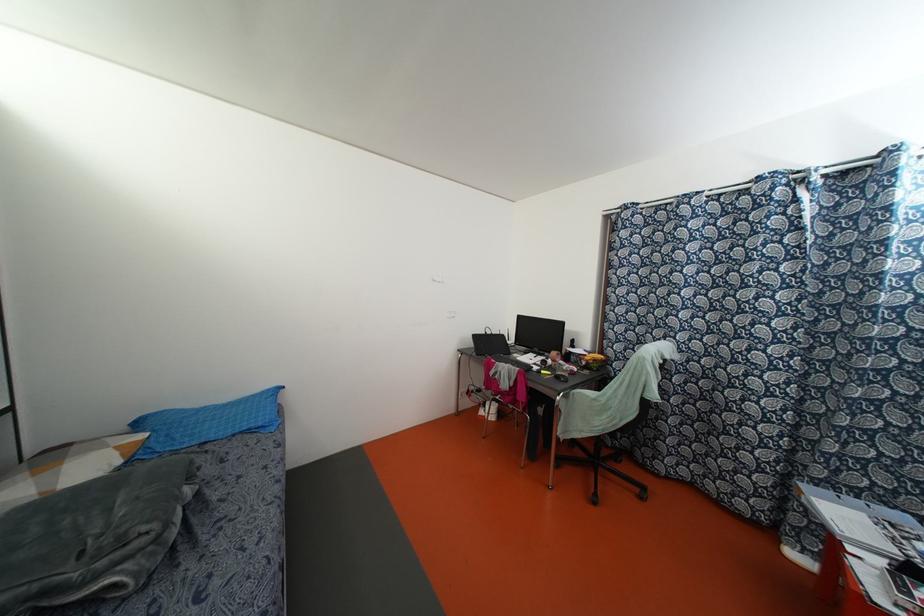
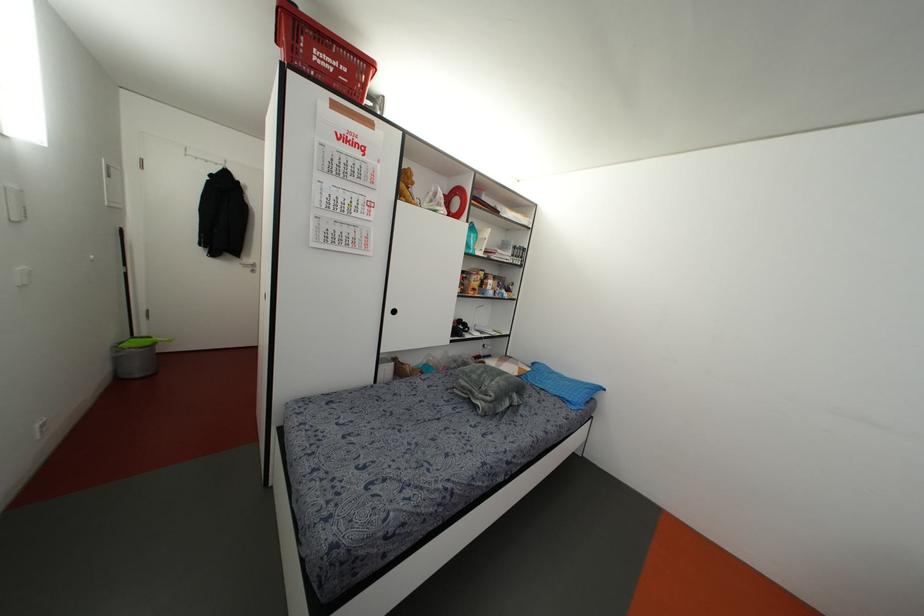
Question: The camera is either moving clockwise (left) or counter-clockwise (right) around the object. The first image is from the beginning of the video and the second image is from the end. Is the camera moving left or right when shooting the video?

Choices:
 (A) Left
 (B) Right

Answer: (B)